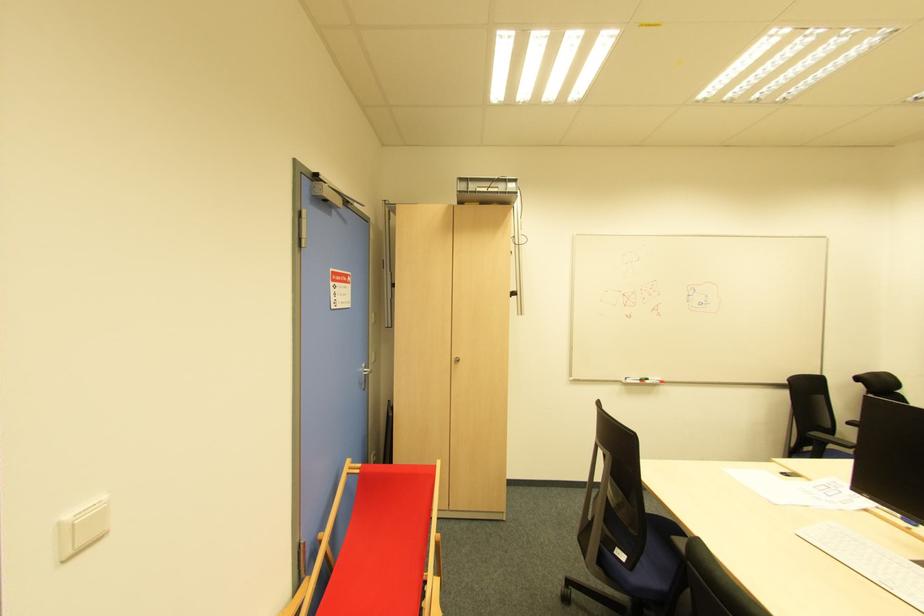
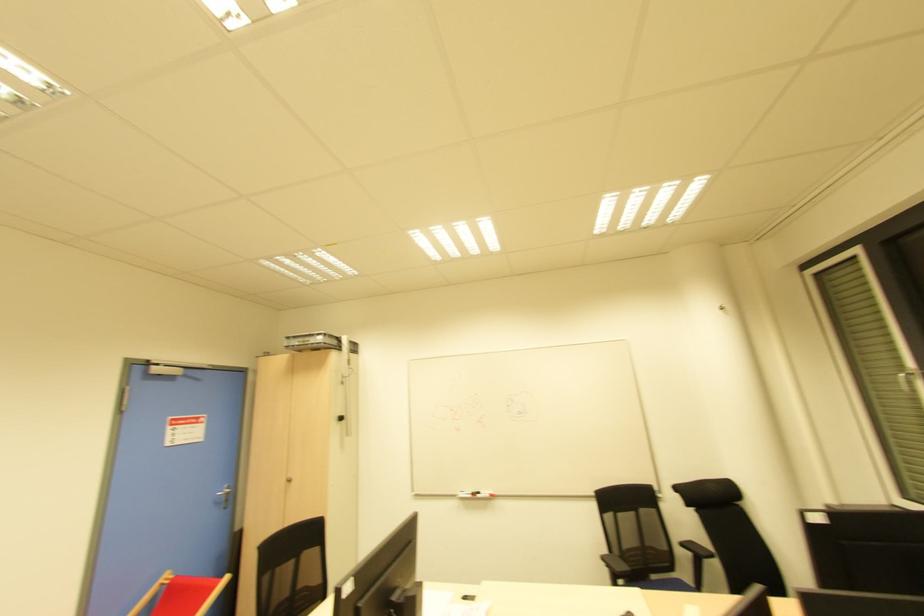
Question: The images are taken continuously from a first-person perspective. In which direction are you moving?

Choices:
 (A) Left
 (B) Right
 (C) Forward
 (D) Backward

Answer: (B)